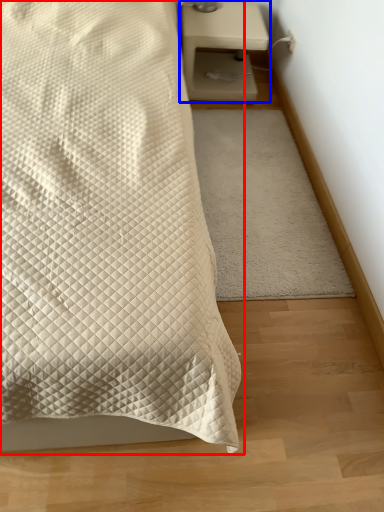
Question: Which point is further to the camera, bed (highlighted by a red box) or nightstand (highlighted by a blue box)?

Choices:
 (A) bed
 (B) nightstand

Answer: (B)